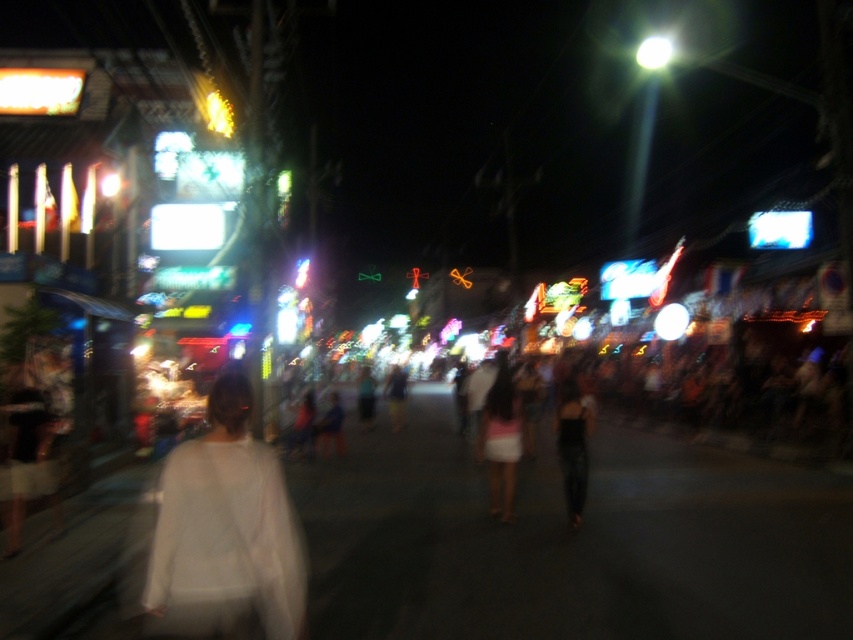
You are a fashion photographer who wants to capture both the white matte shirt at center and the matte black dress at center in a single photo. Since the scene is very bright, you need to adjust your camera settings to ensure both are visible. Which clothing item might require a different exposure setting to avoid being overexposed?

The white matte shirt at center is above matte black dress at center, so the white matte shirt at center might require a different exposure setting to avoid being overexposed due to its brightness in the scene.

You are a fashion photographer who wants to capture both the white matte shirt at center and the matte black dress at center in a single frame. Considering their heights, which one might you need to adjust your camera angle for to ensure both are fully visible in the photo?

The white matte shirt at center is shorter than the matte black dress at center. To ensure both are fully visible, you might need to lower your camera angle slightly to accommodate the taller matte black dress at center while still capturing the shorter white matte shirt at center.

You are a fashion designer observing a street scene at night. You notice two outfits in the crowd. The first is a pink fabric skirt at center and the second is a matte black dress at center. Which outfit takes up more visual space in the image?

The pink fabric skirt at center is larger in size than the matte black dress at center, so it takes up more visual space in the image.